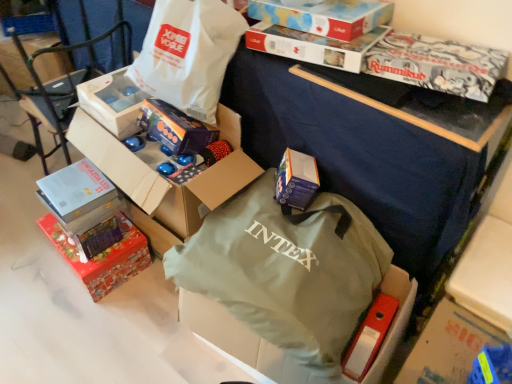
Identify the location of blue cardboard box at center, the second box in the bottom-to-top sequence. Image resolution: width=512 pixels, height=384 pixels. (296, 179).

What is the approximate height of matte cardboard box at left?

Result: 34.92 inches.

What is the approximate width of red glossy gift box at lower left, which appears as the 5th box when viewed from the top?

11.08 inches.

This screenshot has height=384, width=512. I want to click on matte cardboard box at upper center, the 4th box in the bottom-to-top sequence, so click(312, 46).

Image resolution: width=512 pixels, height=384 pixels. Describe the element at coordinates (175, 128) in the screenshot. I see `matte purple gift box at center` at that location.

Where is `blue cardboard box at center, which ranks as the fourth box in top-to-bottom order`? The width and height of the screenshot is (512, 384). blue cardboard box at center, which ranks as the fourth box in top-to-bottom order is located at coordinates (296, 179).

Which is behind, point (263, 32) or point (376, 286)?

The point (263, 32) is farther.

What's the angular difference between matte cardboard box at upper center, arranged as the second box when viewed from the top, and green fabric bag at center, acting as the first bag starting from the bottom,'s facing directions?

3.18 degrees.

Choose the correct answer: Is matte cardboard box at upper center, the 4th box in the bottom-to-top sequence, inside green fabric bag at center, the second bag from the top, or outside it?

The correct answer is: outside.

From a real-world perspective, starting from the matte cardboard box at upper center, the 4th box in the bottom-to-top sequence, which bag is the 2nd one below it? Please provide its 2D coordinates.

[(287, 270)]

Is white matte box at upper left, acting as the third box starting from the bottom, closer to camera compared to white paper bag at upper center, marked as the second bag in a bottom-to-top arrangement?

No.

In the image, is white matte box at upper left, the third box positioned from the top, on the left side or the right side of white paper bag at upper center, marked as the second bag in a bottom-to-top arrangement?

From the image, it's evident that white matte box at upper left, the third box positioned from the top, is to the left of white paper bag at upper center, marked as the second bag in a bottom-to-top arrangement.

In the scene shown: Between white matte box at upper left, acting as the third box starting from the bottom, and white paper bag at upper center, marked as the second bag in a bottom-to-top arrangement, which one has larger width?

With larger width is white paper bag at upper center, marked as the second bag in a bottom-to-top arrangement.

Is white matte box at upper left, the third box positioned from the top, completely or partially outside of white paper bag at upper center, the first bag viewed from the top?

That's correct, white matte box at upper left, the third box positioned from the top, is outside of white paper bag at upper center, the first bag viewed from the top.

From the image's perspective, is matte purple gift box at center located beneath white paper bag at upper center, marked as the second bag in a bottom-to-top arrangement?

Yes, from the image's perspective, matte purple gift box at center is below white paper bag at upper center, marked as the second bag in a bottom-to-top arrangement.

From a real-world perspective, is matte purple gift box at center positioned above or below white paper bag at upper center, marked as the second bag in a bottom-to-top arrangement?

matte purple gift box at center is below white paper bag at upper center, marked as the second bag in a bottom-to-top arrangement.

Considering the positions of points (184, 132) and (151, 81), is point (184, 132) closer to camera compared to point (151, 81)?

Yes.

Which of these two, matte purple gift box at center or white paper bag at upper center, marked as the second bag in a bottom-to-top arrangement, is wider?

With larger width is white paper bag at upper center, marked as the second bag in a bottom-to-top arrangement.

In the scene shown: Looking at their sizes, would you say blue cardboard box at center, which ranks as the fourth box in top-to-bottom order, is wider or thinner than white paper bag at upper center, marked as the second bag in a bottom-to-top arrangement?

blue cardboard box at center, which ranks as the fourth box in top-to-bottom order, is thinner than white paper bag at upper center, marked as the second bag in a bottom-to-top arrangement.

Which object is further away from the camera, blue cardboard box at center, the second box in the bottom-to-top sequence, or white paper bag at upper center, marked as the second bag in a bottom-to-top arrangement?

blue cardboard box at center, the second box in the bottom-to-top sequence, is further away from the camera.

Could you tell me if blue cardboard box at center, the second box in the bottom-to-top sequence, is turned towards white paper bag at upper center, the first bag viewed from the top?

No, blue cardboard box at center, the second box in the bottom-to-top sequence, is not turned towards white paper bag at upper center, the first bag viewed from the top.

Is blue cardboard box at center, the second box in the bottom-to-top sequence, at the right side of white paper bag at upper center, marked as the second bag in a bottom-to-top arrangement?

Yes.

From the image's perspective, is matte cardboard box at left located above white paper bag at upper center, the first bag viewed from the top?

No, from the image's perspective, matte cardboard box at left is not over white paper bag at upper center, the first bag viewed from the top.

In the scene shown: Which object is closer to the camera taking this photo, matte cardboard box at left or white paper bag at upper center, the first bag viewed from the top?

white paper bag at upper center, the first bag viewed from the top, is more forward.

Is point (24, 58) closer to camera compared to point (194, 69)?

No, (24, 58) is behind (194, 69).

Does point (78, 72) come in front of point (97, 286)?

No, (78, 72) is behind (97, 286).

From the image's perspective, is matte cardboard box at left located beneath red glossy gift box at lower left, which appears as the 5th box when viewed from the top?

No.

Is matte cardboard box at left facing towards red glossy gift box at lower left, the first box when ordered from bottom to top?

No, matte cardboard box at left is not facing towards red glossy gift box at lower left, the first box when ordered from bottom to top.

Locate an element on the screen. armchair in front of the red glossy gift box at lower left, the first box when ordered from bottom to top is located at coordinates [62, 83].

In the scene shown: Is white paper bag at upper center, marked as the second bag in a bottom-to-top arrangement, facing towards matte cardboard box at left?

No.

Between white paper bag at upper center, marked as the second bag in a bottom-to-top arrangement, and matte cardboard box at left, which one has smaller width?

Thinner between the two is white paper bag at upper center, marked as the second bag in a bottom-to-top arrangement.

Based on the photo, from the image's perspective, relative to matte cardboard box at left, is white paper bag at upper center, marked as the second bag in a bottom-to-top arrangement, above or below?

From the image's perspective, white paper bag at upper center, marked as the second bag in a bottom-to-top arrangement, appears above matte cardboard box at left.

Is point (165, 22) positioned after point (57, 129)?

That is False.

Starting from the matte cardboard box at upper center, arranged as the second box when viewed from the top, which bag is the 1st one to the left? Please provide its 2D coordinates.

[(287, 270)]

From the white paper bag at upper center, the first bag viewed from the top, count 4th boxs backward and point to it. Please provide its 2D coordinates.

[(112, 102)]

Based on their spatial positions, is matte cardboard box at upper center, arranged as the second box when viewed from the top, or matte purple gift box at center further from red glossy gift box at lower left, the first box when ordered from bottom to top?

The object further to red glossy gift box at lower left, the first box when ordered from bottom to top, is matte cardboard box at upper center, arranged as the second box when viewed from the top.

From the image, which object appears to be farther from matte cardboard box at upper center, which is the fifth box from bottom to top, green fabric bag at center, the second bag from the top, or red glossy gift box at lower left, which appears as the 5th box when viewed from the top?

red glossy gift box at lower left, which appears as the 5th box when viewed from the top, lies further to matte cardboard box at upper center, which is the fifth box from bottom to top, than the other object.

Based on their spatial positions, is matte cardboard box at left or red glossy gift box at lower left, the first box when ordered from bottom to top, closer to white paper bag at upper center, the first bag viewed from the top?

matte cardboard box at left.

Based on their spatial positions, is white matte box at upper left, the third box positioned from the top, or blue cardboard box at center, which ranks as the fourth box in top-to-bottom order, closer to green fabric bag at center, the second bag from the top?

blue cardboard box at center, which ranks as the fourth box in top-to-bottom order, lies closer to green fabric bag at center, the second bag from the top, than the other object.

Which object lies further to the anchor point matte cardboard box at left, matte cardboard box at upper center, which is the fifth box from bottom to top, or matte cardboard box at upper center, the 4th box in the bottom-to-top sequence?

Based on the image, matte cardboard box at upper center, which is the fifth box from bottom to top, appears to be further to matte cardboard box at left.

Looking at the image, which one is located closer to matte purple gift box at center, red glossy gift box at lower left, the first box when ordered from bottom to top, or blue cardboard box at center, the second box in the bottom-to-top sequence?

blue cardboard box at center, the second box in the bottom-to-top sequence, is positioned closer to the anchor matte purple gift box at center.

Estimate the real-world distances between objects in this image. Which object is further from white matte box at upper left, acting as the third box starting from the bottom, blue cardboard box at center, the second box in the bottom-to-top sequence, or white paper bag at upper center, the first bag viewed from the top?

Among the two, blue cardboard box at center, the second box in the bottom-to-top sequence, is located further to white matte box at upper left, acting as the third box starting from the bottom.

From the image, which object appears to be farther from matte cardboard box at upper center, which is the 1th box in top-to-bottom order, matte cardboard box at upper center, arranged as the second box when viewed from the top, or white matte box at upper left, the third box positioned from the top?

white matte box at upper left, the third box positioned from the top, lies further to matte cardboard box at upper center, which is the 1th box in top-to-bottom order, than the other object.

The width and height of the screenshot is (512, 384). Find the location of `gift box between matte cardboard box at left and red glossy gift box at lower left, the first box when ordered from bottom to top, in the up-down direction`. gift box between matte cardboard box at left and red glossy gift box at lower left, the first box when ordered from bottom to top, in the up-down direction is located at coordinates (175, 128).

You are a GUI agent. You are given a task and a screenshot of the screen. Output one action in this format:
    pyautogui.click(x=<x>, y=<y>)
    Task: Click on the gift box between white matte box at upper left, the third box positioned from the top, and green fabric bag at center, acting as the first bag starting from the bottom, in the vertical direction
    The image size is (512, 384).
    Given the screenshot: What is the action you would take?
    pyautogui.click(x=175, y=128)

Where is `gift box between white matte box at upper left, the third box positioned from the top, and blue cardboard box at center, the second box in the bottom-to-top sequence`? The width and height of the screenshot is (512, 384). gift box between white matte box at upper left, the third box positioned from the top, and blue cardboard box at center, the second box in the bottom-to-top sequence is located at coordinates (175, 128).

I want to click on gift box between matte cardboard box at upper center, which is the fifth box from bottom to top, and blue cardboard box at center, which ranks as the fourth box in top-to-bottom order, vertically, so click(175, 128).